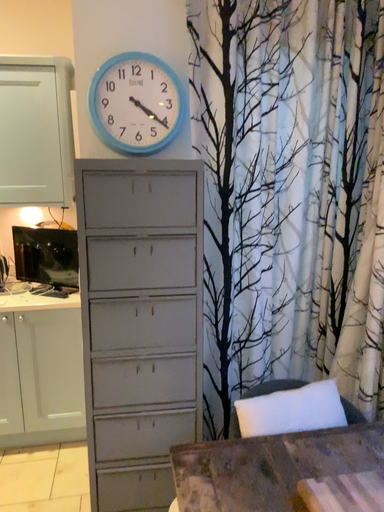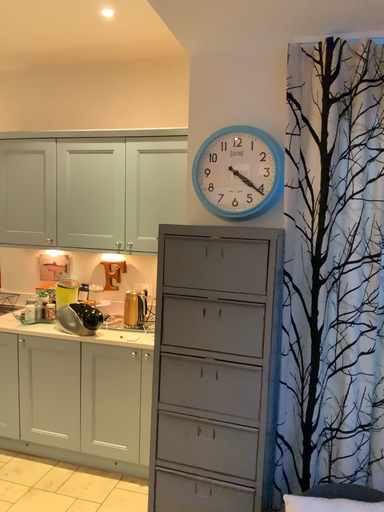
Question: How did the camera likely rotate when shooting the video?

Choices:
 (A) rotated downward
 (B) rotated upward

Answer: (B)